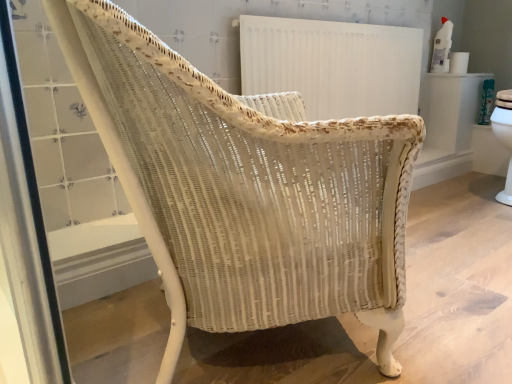
At what (x,y) coordinates should I click in order to perform the action: click on vacant space situated above white textured radiator at upper center (from a real-world perspective). Please return your answer as a coordinate pair (x, y). Looking at the image, I should click on (327, 18).